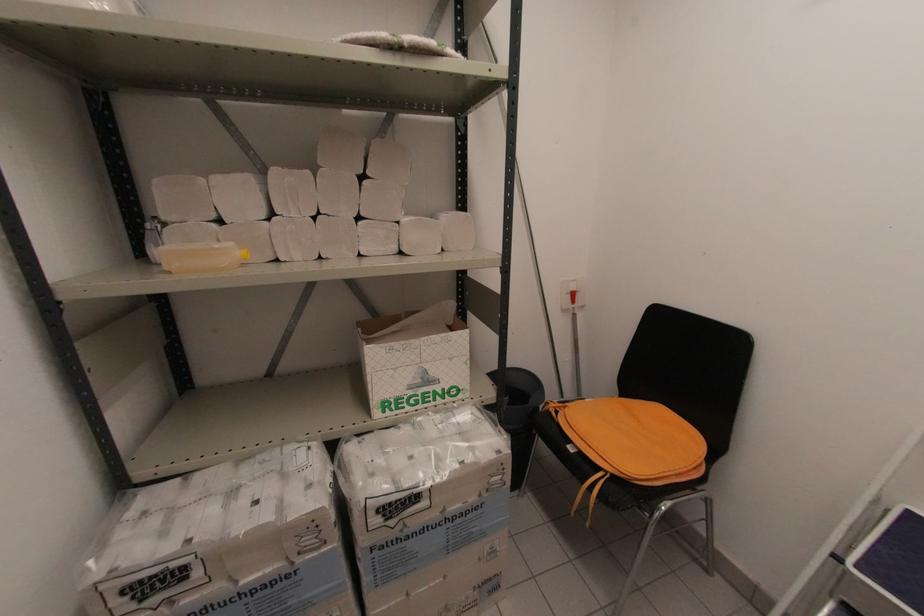
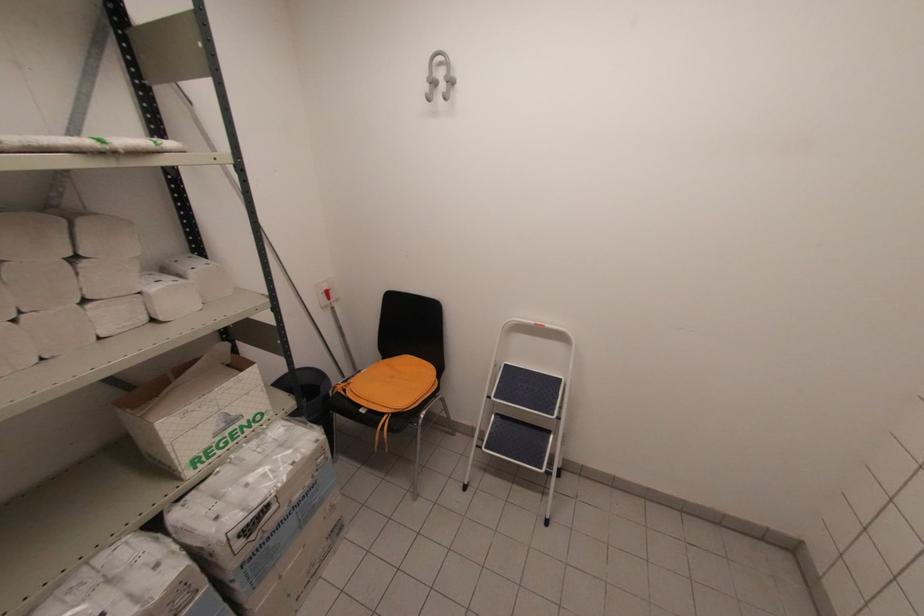
Question: How did the camera likely rotate?

Choices:
 (A) Left
 (B) Right
 (C) Up
 (D) Down

Answer: (B)